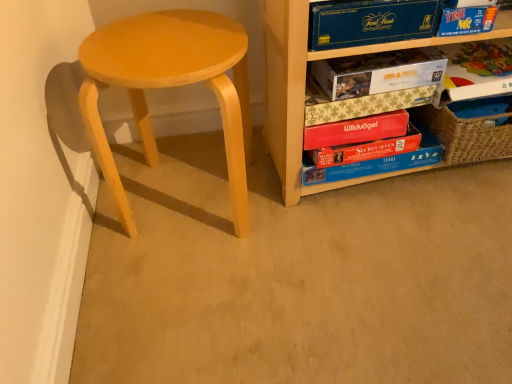
Locate an element on the screen. This screenshot has height=384, width=512. vacant area that lies in front of wooden puzzle boxes at right is located at coordinates (395, 256).